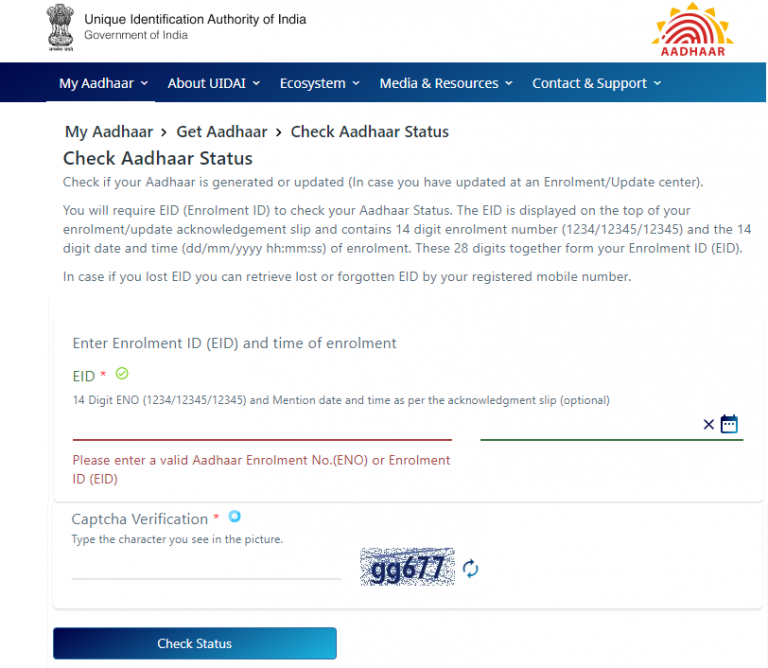
The image size is (768, 668). I want to click on calendar, so click(x=730, y=432).